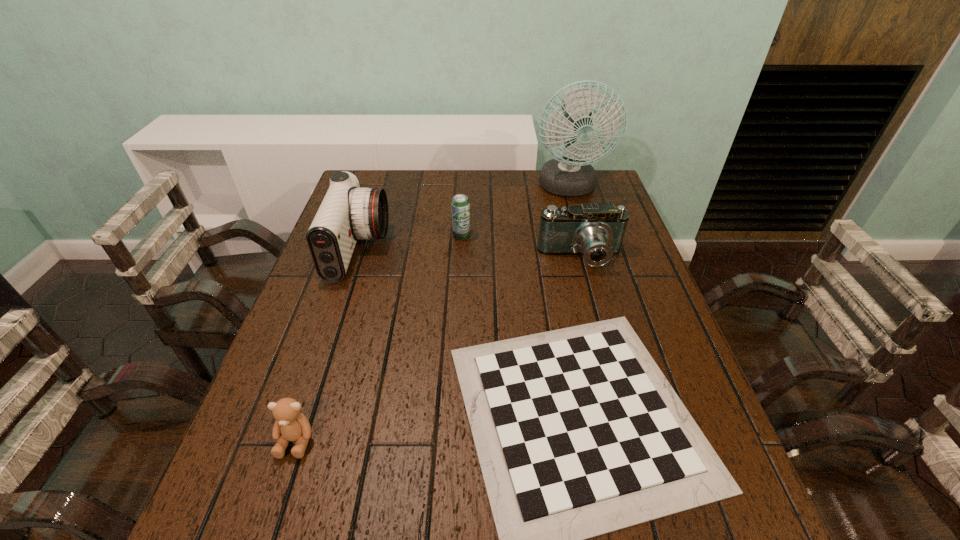
Identify the location of the farthest object. The width and height of the screenshot is (960, 540). (570, 175).

Where is `fan`? This screenshot has height=540, width=960. fan is located at coordinates (570, 175).

Find the location of `the left camcorder`. the left camcorder is located at coordinates point(348,212).

Image resolution: width=960 pixels, height=540 pixels. Find the location of `the taller camcorder`. the taller camcorder is located at coordinates [348, 212].

What are the coordinates of `the right camcorder` in the screenshot? It's located at (596, 231).

The image size is (960, 540). I want to click on beer can, so click(x=460, y=205).

This screenshot has width=960, height=540. In order to click on teddy bear in this screenshot , I will do `click(291, 425)`.

I want to click on free location located in front of the tallest object where the airflow is directed, so click(587, 252).

I want to click on vacant space located 0.100m on the surface of the fifth shortest object, so click(420, 250).

This screenshot has height=540, width=960. What are the coordinates of `vacant region located on the front-facing side of the right camcorder` in the screenshot? It's located at coord(594,309).